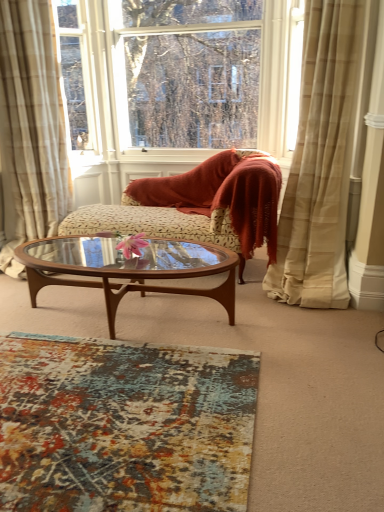
Question: Is brown wood/glass coffee table at center located outside beige plaid curtain at right, which appears as the 1th curtain when viewed from the right?

Choices:
 (A) yes
 (B) no

Answer: (A)

Question: Is the depth of brown wood/glass coffee table at center greater than that of beige plaid curtain at right, which appears as the 1th curtain when viewed from the right?

Choices:
 (A) yes
 (B) no

Answer: (A)

Question: From the image's perspective, is brown wood/glass coffee table at center located above beige plaid curtain at right, which appears as the 1th curtain when viewed from the right?

Choices:
 (A) yes
 (B) no

Answer: (B)

Question: Can you confirm if brown wood/glass coffee table at center is taller than beige plaid curtain at right, which appears as the 1th curtain when viewed from the right?

Choices:
 (A) yes
 (B) no

Answer: (B)

Question: Is brown wood/glass coffee table at center far from beige plaid curtain at right, which appears as the 1th curtain when viewed from the right?

Choices:
 (A) yes
 (B) no

Answer: (B)

Question: From a real-world perspective, is brown wood/glass coffee table at center physically above beige plaid curtain at right, marked as the second curtain in a left-to-right arrangement?

Choices:
 (A) no
 (B) yes

Answer: (A)

Question: From a real-world perspective, is beige plaid curtain at left, positioned as the 1th curtain in left-to-right order, under brown wood/glass coffee table at center?

Choices:
 (A) yes
 (B) no

Answer: (B)

Question: Is brown wood/glass coffee table at center at the back of beige plaid curtain at left, positioned as the 1th curtain in left-to-right order?

Choices:
 (A) yes
 (B) no

Answer: (B)

Question: Considering the relative sizes of beige plaid curtain at left, the 2th curtain when ordered from right to left, and brown wood/glass coffee table at center in the image provided, is beige plaid curtain at left, the 2th curtain when ordered from right to left, thinner than brown wood/glass coffee table at center?

Choices:
 (A) yes
 (B) no

Answer: (B)

Question: Could you tell me if beige plaid curtain at left, the 2th curtain when ordered from right to left, is facing brown wood/glass coffee table at center?

Choices:
 (A) yes
 (B) no

Answer: (B)

Question: Can you confirm if beige plaid curtain at left, positioned as the 1th curtain in left-to-right order, is shorter than brown wood/glass coffee table at center?

Choices:
 (A) yes
 (B) no

Answer: (B)

Question: Can you confirm if beige plaid curtain at left, the 2th curtain when ordered from right to left, is wider than brown wood/glass coffee table at center?

Choices:
 (A) no
 (B) yes

Answer: (B)

Question: From a real-world perspective, is brown wood/glass coffee table at center positioned over beige plaid curtain at left, the 2th curtain when ordered from right to left, based on gravity?

Choices:
 (A) yes
 (B) no

Answer: (B)